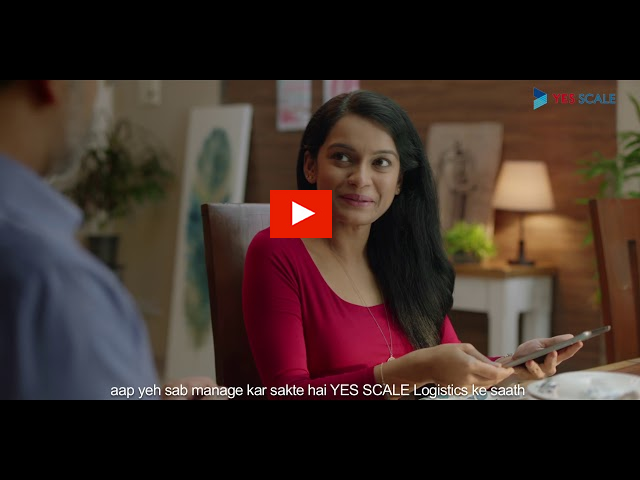
This screenshot has width=640, height=480. I want to click on wall, so click(452, 96).